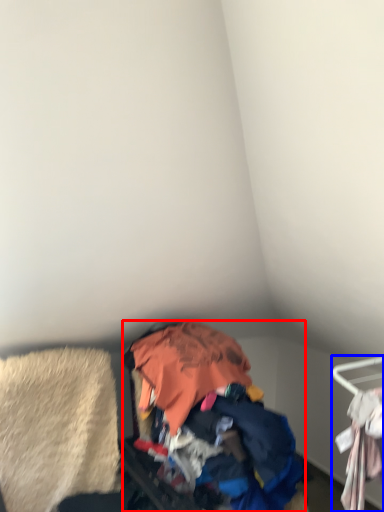
Question: Among these objects, which one is nearest to the camera, garbage (highlighted by a red box) or furniture (highlighted by a blue box)?

Choices:
 (A) garbage
 (B) furniture

Answer: (B)